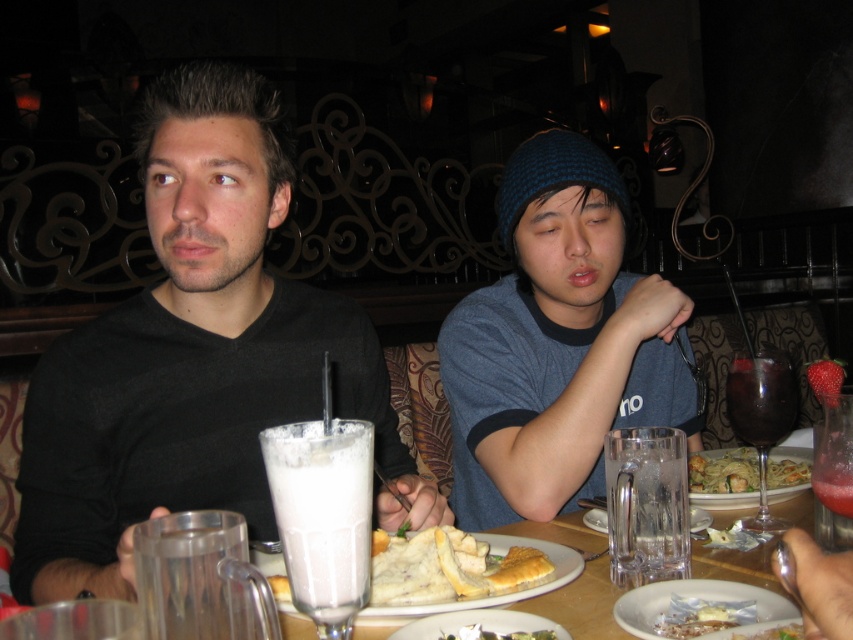
Does white frothy milkshake at center have a greater width compared to green matte pasta at center?

No.

Which of these two, white frothy milkshake at center or green matte pasta at center, stands taller?

Standing taller between the two is white frothy milkshake at center.

Locate an element on the screen. This screenshot has height=640, width=853. white frothy milkshake at center is located at coordinates (322, 513).

I want to click on white frothy milkshake at center, so [322, 513].

Can you confirm if black matte shirt at center is wider than white creamy dessert at center?

Yes, black matte shirt at center is wider than white creamy dessert at center.

Is point (247, 333) positioned behind point (503, 636)?

Yes, it is.

Locate an element on the screen. The image size is (853, 640). black matte shirt at center is located at coordinates (194, 356).

Who is taller, clear glass water at center or white creamy sauce at plate center?

clear glass water at center

Which is more to the left, clear glass water at center or white creamy sauce at plate center?

From the viewer's perspective, clear glass water at center appears more on the left side.

The image size is (853, 640). Find the location of `clear glass water at center`. clear glass water at center is located at coordinates (646, 506).